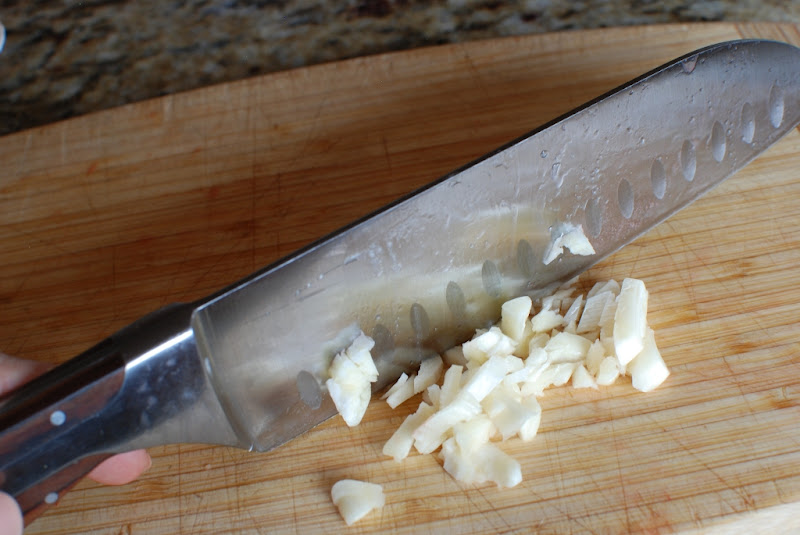
Image resolution: width=800 pixels, height=535 pixels. In order to click on countertop in this screenshot , I will do `click(122, 68)`.